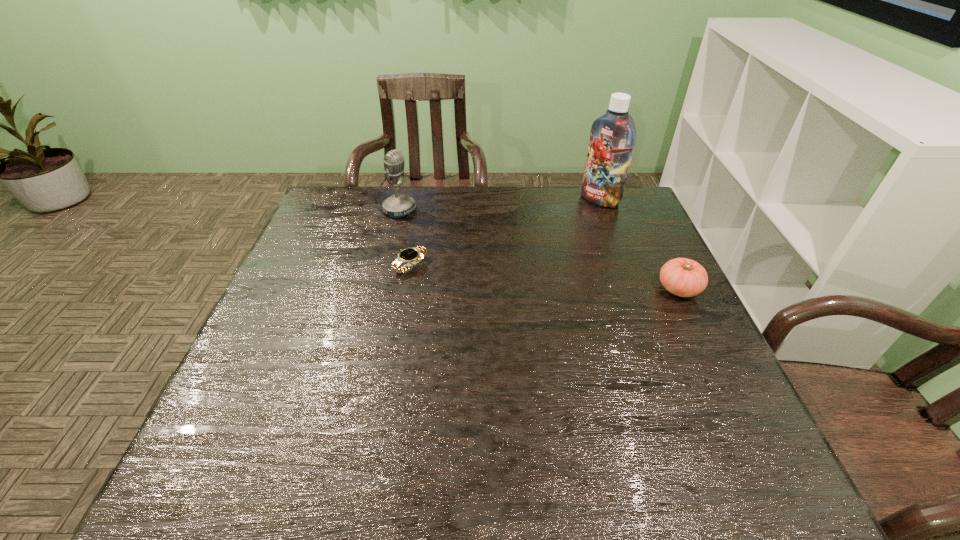
I want to click on the shortest object, so click(x=412, y=255).

Locate an element on the screen. tomato is located at coordinates (x=683, y=277).

This screenshot has width=960, height=540. In order to click on the rightmost object in this screenshot , I will do pos(683,277).

You are a GUI agent. You are given a task and a screenshot of the screen. Output one action in this format:
    pyautogui.click(x=<x>, y=<y>)
    Task: Click on the microphone
    This screenshot has width=960, height=540.
    Given the screenshot: What is the action you would take?
    pyautogui.click(x=398, y=205)

Image resolution: width=960 pixels, height=540 pixels. Identify the location of the second object from right to left. (612, 136).

Where is `shampoo`? Image resolution: width=960 pixels, height=540 pixels. shampoo is located at coordinates (612, 136).

This screenshot has width=960, height=540. Identify the location of vacant area situated on the left of the watch. (339, 265).

Locate an element on the screen. This screenshot has width=960, height=540. free space located on the front of the third tallest object is located at coordinates (713, 360).

Locate an element on the screen. blank space located on the front-facing side of the microphone is located at coordinates (488, 260).

At what (x,y) coordinates should I click in order to perform the action: click on free point located 0.250m on the front-facing side of the microphone. Please return your answer as a coordinate pair (x, y). The image size is (960, 540). Looking at the image, I should click on (469, 250).